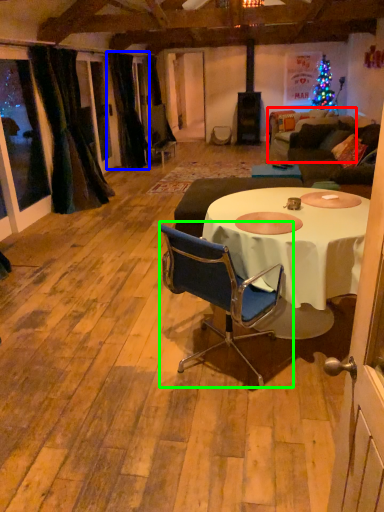
Question: Which object is positioned closest to couch (highlighted by a red box)? Select from curtain (highlighted by a blue box) and chair (highlighted by a green box).

Choices:
 (A) curtain
 (B) chair

Answer: (A)